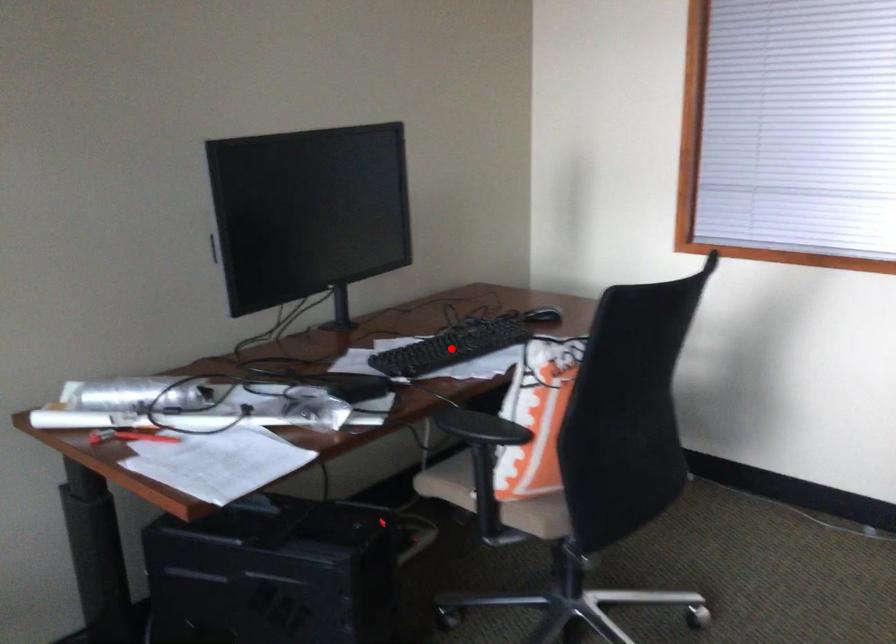
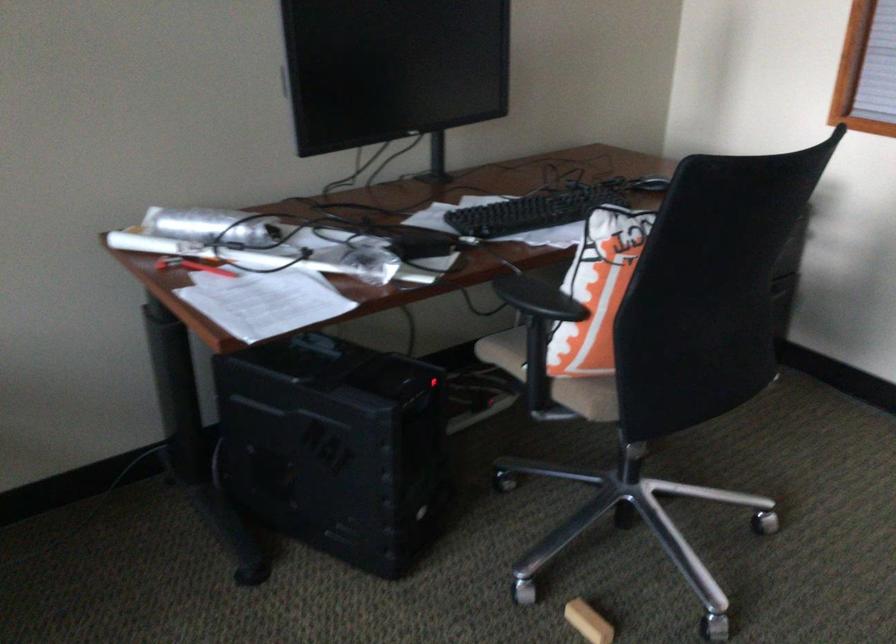
In the second image, find the point that corresponds to the highlighted location in the first image.

(532, 211)